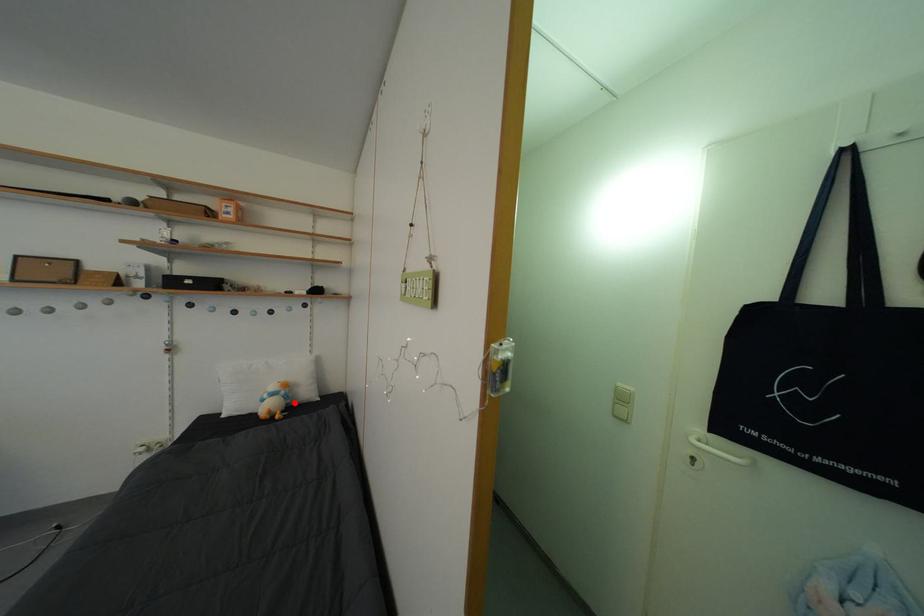
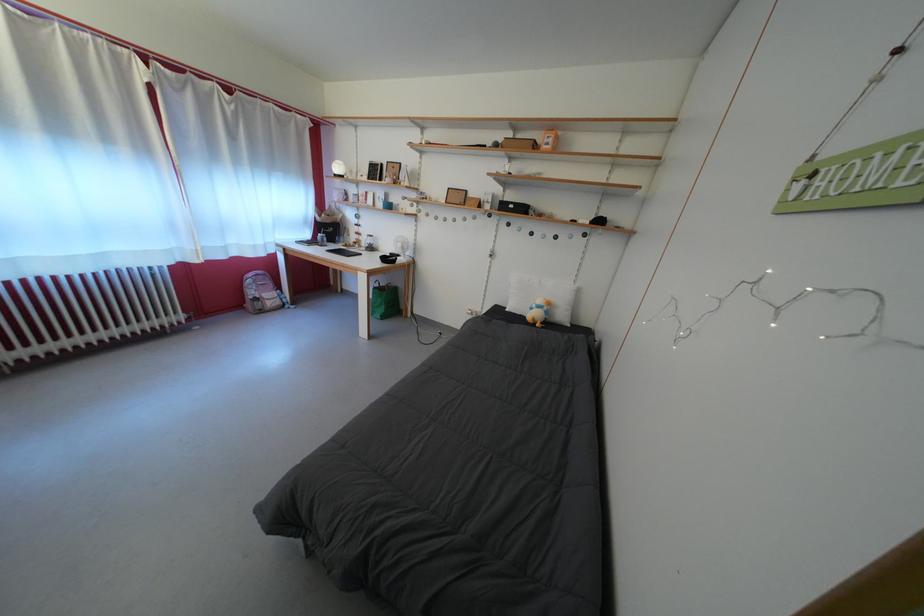
Question: I am providing you with two images of the same scene from different viewpoints. Given a red point in image1, look at the same physical point in image2. Is it:

Choices:
 (A) Closer to the viewpoint
 (B) Farther from the viewpoint

Answer: (A)